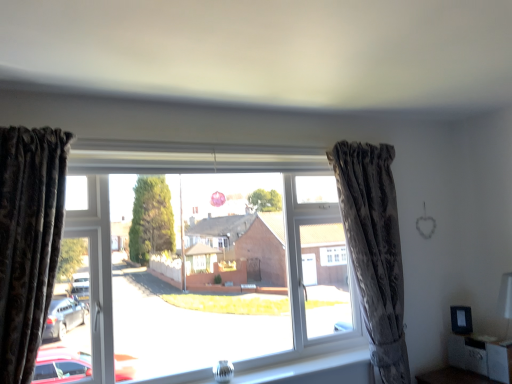
Question: Is velvet dark brown curtain at left, placed as the second curtain when sorted from back to front, at the right side of matte black cabinet at lower right?

Choices:
 (A) no
 (B) yes

Answer: (A)

Question: From a real-world perspective, is velvet dark brown curtain at left, the first curtain in the left-to-right sequence, positioned under matte black cabinet at lower right based on gravity?

Choices:
 (A) yes
 (B) no

Answer: (B)

Question: Is velvet dark brown curtain at left, acting as the 2th curtain starting from the right, not inside matte black cabinet at lower right?

Choices:
 (A) yes
 (B) no

Answer: (A)

Question: Does velvet dark brown curtain at left, acting as the 2th curtain starting from the right, touch matte black cabinet at lower right?

Choices:
 (A) yes
 (B) no

Answer: (B)

Question: From a real-world perspective, is velvet dark brown curtain at left, placed as the second curtain when sorted from back to front, on matte black cabinet at lower right?

Choices:
 (A) yes
 (B) no

Answer: (A)

Question: Is velvet dark brown curtain at left, the first curtain in the left-to-right sequence, positioned in front of matte black cabinet at lower right?

Choices:
 (A) no
 (B) yes

Answer: (B)

Question: Does matte black cabinet at lower right turn towards camouflage fabric curtain at right, marked as the second curtain in a left-to-right arrangement?

Choices:
 (A) no
 (B) yes

Answer: (A)

Question: Does matte black cabinet at lower right have a lesser width compared to camouflage fabric curtain at right, the first curtain viewed from the right?

Choices:
 (A) yes
 (B) no

Answer: (B)

Question: Is matte black cabinet at lower right with camouflage fabric curtain at right, marked as the second curtain in a left-to-right arrangement?

Choices:
 (A) no
 (B) yes

Answer: (A)

Question: Is matte black cabinet at lower right turned away from camouflage fabric curtain at right, which is the second curtain in front-to-back order?

Choices:
 (A) yes
 (B) no

Answer: (B)

Question: From a real-world perspective, is matte black cabinet at lower right physically below camouflage fabric curtain at right, marked as the second curtain in a left-to-right arrangement?

Choices:
 (A) yes
 (B) no

Answer: (A)

Question: Does matte black cabinet at lower right have a smaller size compared to camouflage fabric curtain at right, which is the first curtain in back-to-front order?

Choices:
 (A) yes
 (B) no

Answer: (A)

Question: Does camouflage fabric curtain at right, marked as the second curtain in a left-to-right arrangement, come behind clear glass vase at lower center?

Choices:
 (A) no
 (B) yes

Answer: (B)